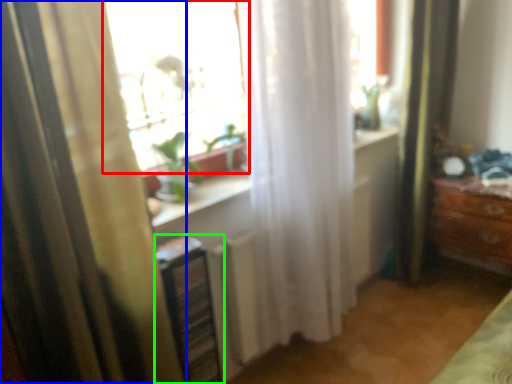
Question: Which object is positioned farthest from window (highlighted by a red box)? Select from curtain (highlighted by a blue box) and shelf (highlighted by a green box).

Choices:
 (A) curtain
 (B) shelf

Answer: (A)